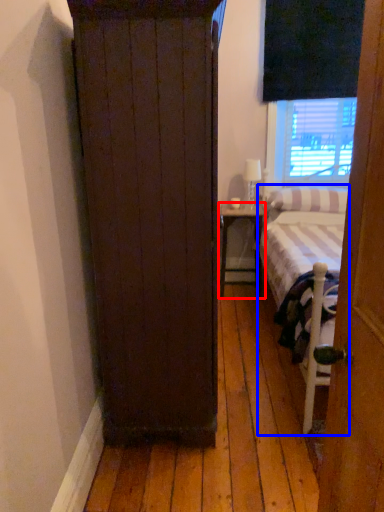
Question: Which object appears closest to the camera in this image, nightstand (highlighted by a red box) or bed (highlighted by a blue box)?

Choices:
 (A) nightstand
 (B) bed

Answer: (B)